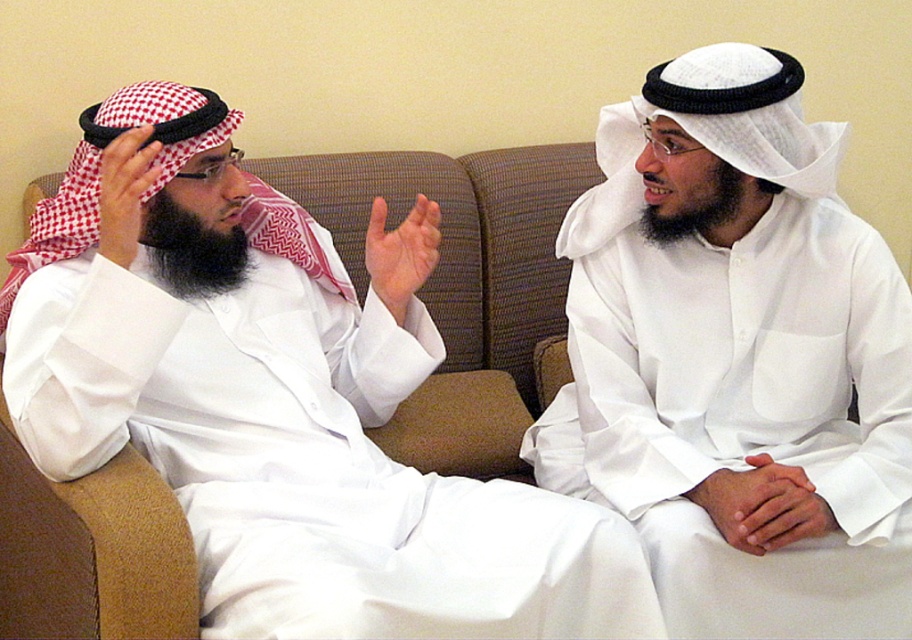
You are an interior designer planning to place a small decorative object at point (401, 252). What object is currently located there?

A matte white hand at center is located at point (401, 252).

You are a photographer taking a picture of the two individuals on the brown couch. You notice a specific point in the image at coordinates point (278, 410). What type of material is present at that location?

The point (278, 410) has white matte soft fabric at left.